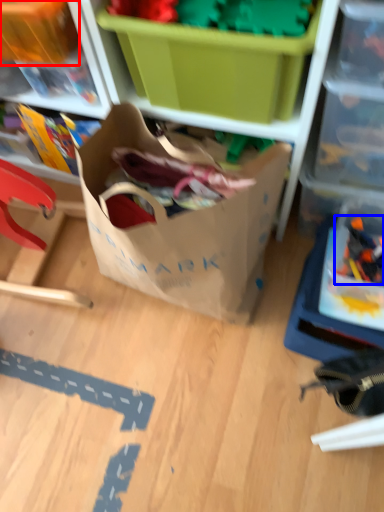
Question: Which object appears farthest to the camera in this image, storage box (highlighted by a red box) or toy (highlighted by a blue box)?

Choices:
 (A) storage box
 (B) toy

Answer: (B)